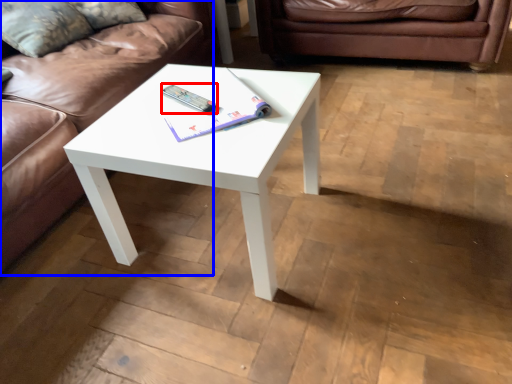
Question: Which object is closer to the camera taking this photo, remote (highlighted by a red box) or studio couch (highlighted by a blue box)?

Choices:
 (A) remote
 (B) studio couch

Answer: (B)